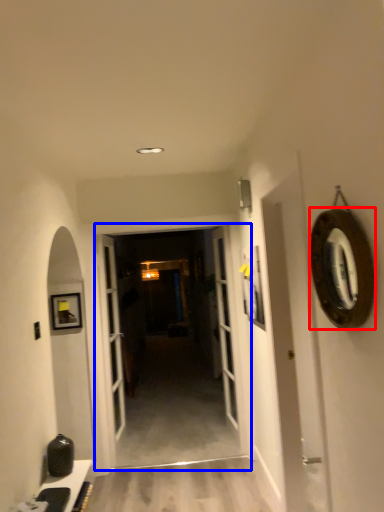
Question: Which of the following is the farthest to the observer, oval (highlighted by a red box) or garage door (highlighted by a blue box)?

Choices:
 (A) oval
 (B) garage door

Answer: (B)